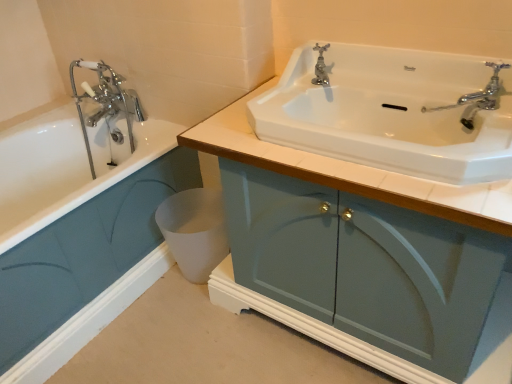
Locate an element on the screen. The image size is (512, 384). free space in front of white matte toilet bowl at lower center is located at coordinates (192, 309).